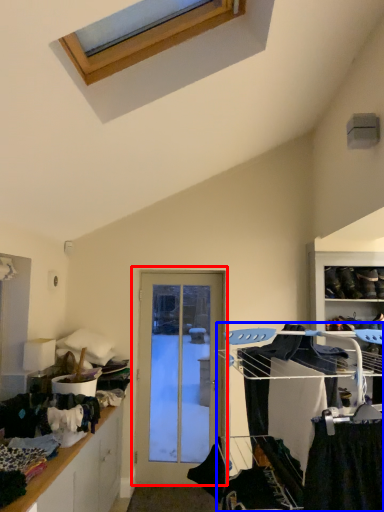
Question: Which object appears farthest to the camera in this image, door (highlighted by a red box) or bunk bed (highlighted by a blue box)?

Choices:
 (A) door
 (B) bunk bed

Answer: (A)